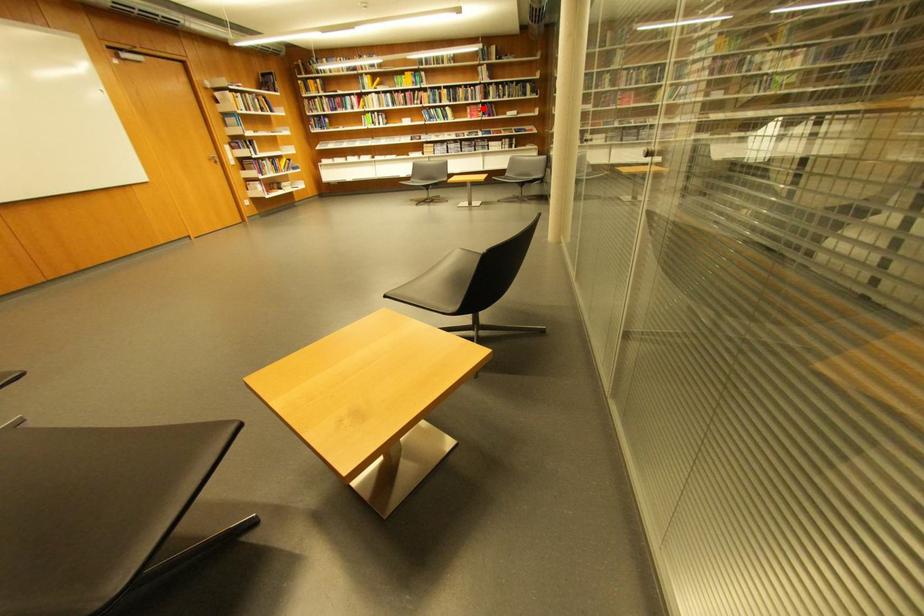
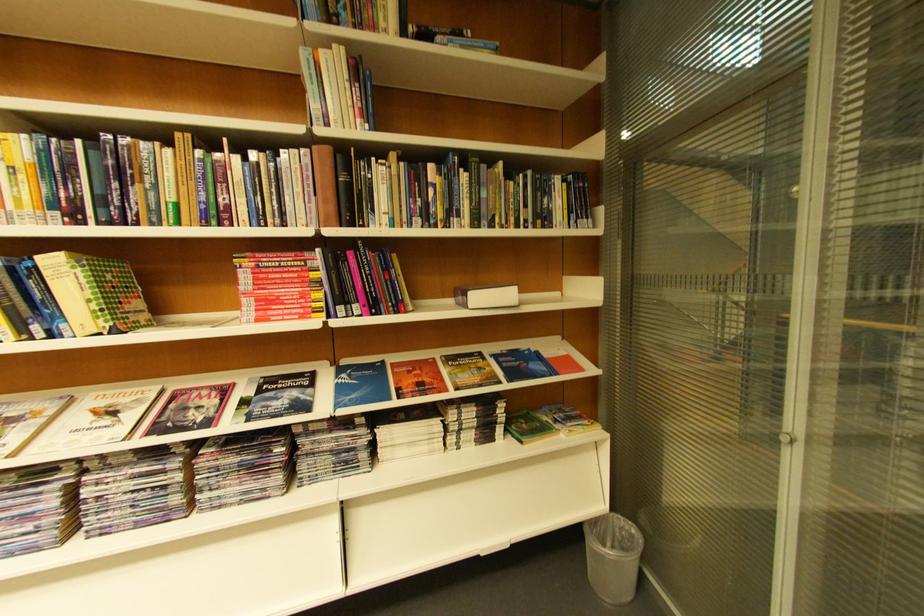
Locate, in the second image, the point that corresponds to the highlighted location in the first image.

(281, 262)